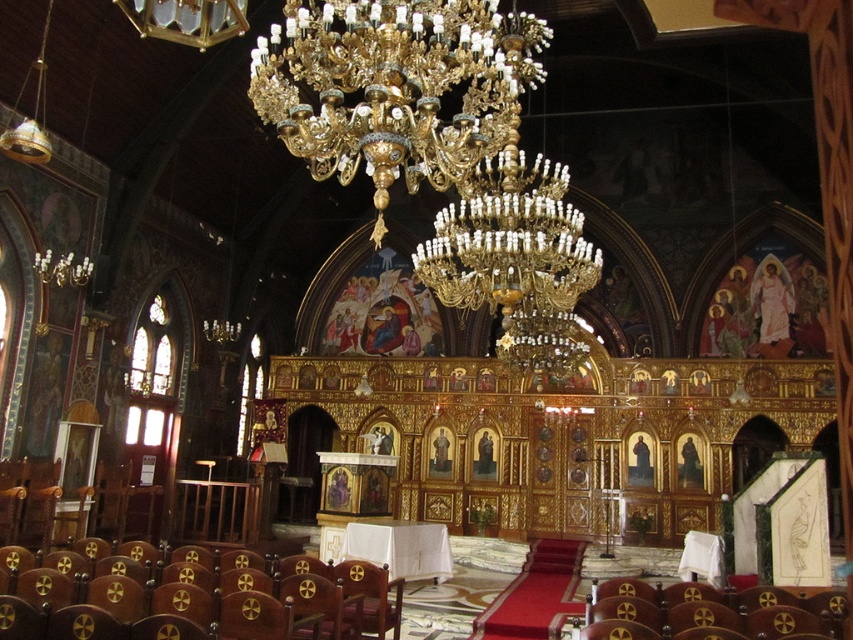
Question: Does gold/gilded chandelier at upper center appear on the left side of wooden with gold crosses at lower left?

Choices:
 (A) no
 (B) yes

Answer: (A)

Question: Observing the image, what is the correct spatial positioning of gold/glass chandelier at center in reference to wooden with gold crosses at lower left?

Choices:
 (A) above
 (B) below

Answer: (A)

Question: Which point is farther to the camera?

Choices:
 (A) (495, 128)
 (B) (207, 593)
 (C) (573, 209)

Answer: (C)

Question: Among these points, which one is nearest to the camera?

Choices:
 (A) (279, 108)
 (B) (265, 605)
 (C) (526, 228)

Answer: (B)

Question: From the image, what is the correct spatial relationship of gold/gilded chandelier at upper center in relation to wooden with gold crosses at lower left?

Choices:
 (A) left
 (B) right

Answer: (B)

Question: Which object is the farthest from the brown leather chair at lower right?

Choices:
 (A) wooden with gold crosses at lower left
 (B) gold/glass chandelier at center
 (C) gold/gilded chandelier at upper center

Answer: (C)